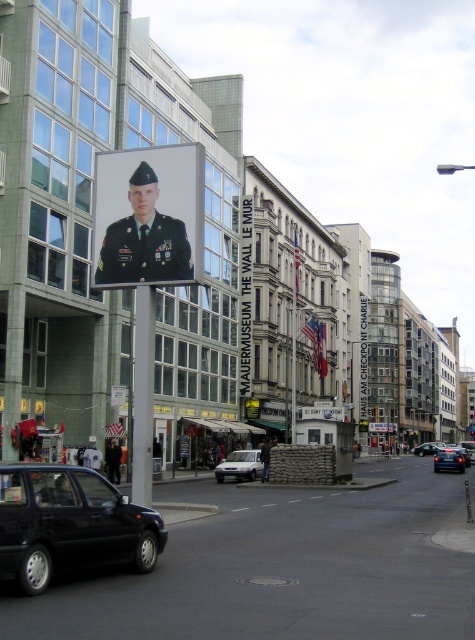
Question: Which point is closer to the camera?

Choices:
 (A) (228, 472)
 (B) (443, 456)

Answer: (A)

Question: Can you confirm if shiny black sedan at lower right is positioned to the left of blue metallic sedan at center?

Choices:
 (A) yes
 (B) no

Answer: (A)

Question: Considering the relative positions of shiny black car at lower left and white matte van at center in the image provided, where is shiny black car at lower left located with respect to white matte van at center?

Choices:
 (A) above
 (B) below

Answer: (A)

Question: Which object appears farthest from the camera in this image?

Choices:
 (A) shiny black sedan at lower right
 (B) metallic pole at center
 (C) blue metallic sedan at center
 (D) white matte van at center

Answer: (C)

Question: Which of these objects is positioned farthest from the shiny black sedan at lower right?

Choices:
 (A) matte black uniform at center
 (B) white matte van at center
 (C) metallic pole at center
 (D) blue metallic sedan at center

Answer: (D)

Question: Does shiny black car at lower left appear under blue metallic sedan at center?

Choices:
 (A) no
 (B) yes

Answer: (A)